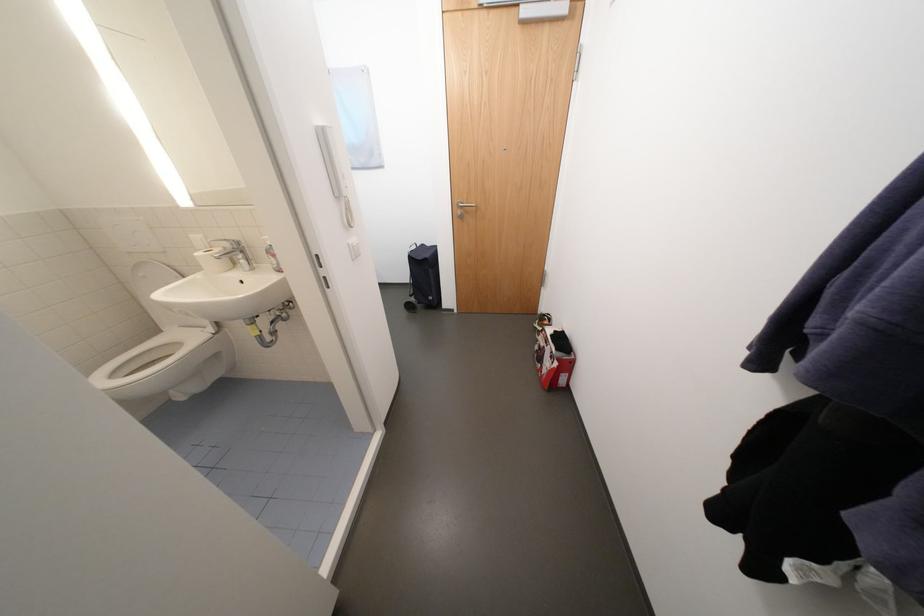
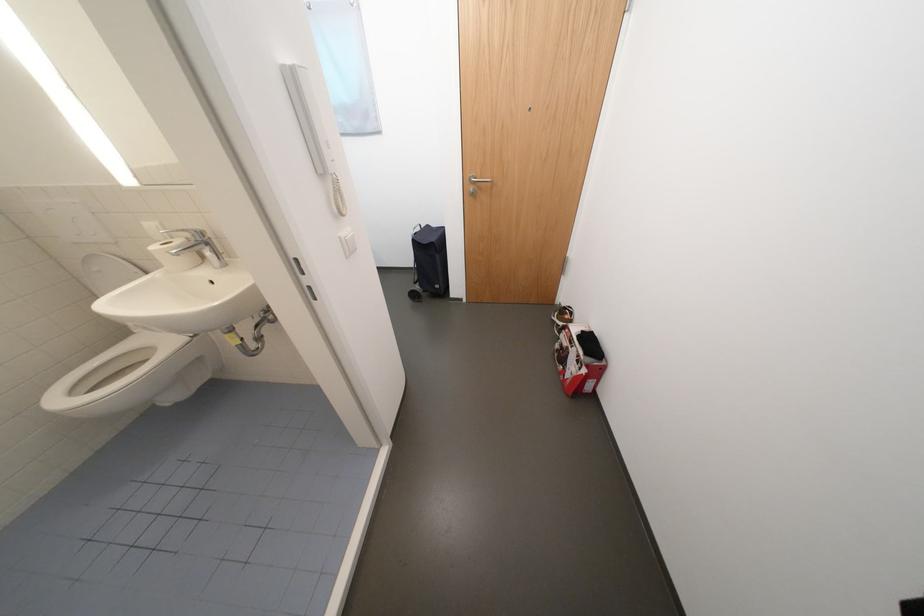
Find the pixel in the second image that matches (564,365) in the first image.

(592, 371)